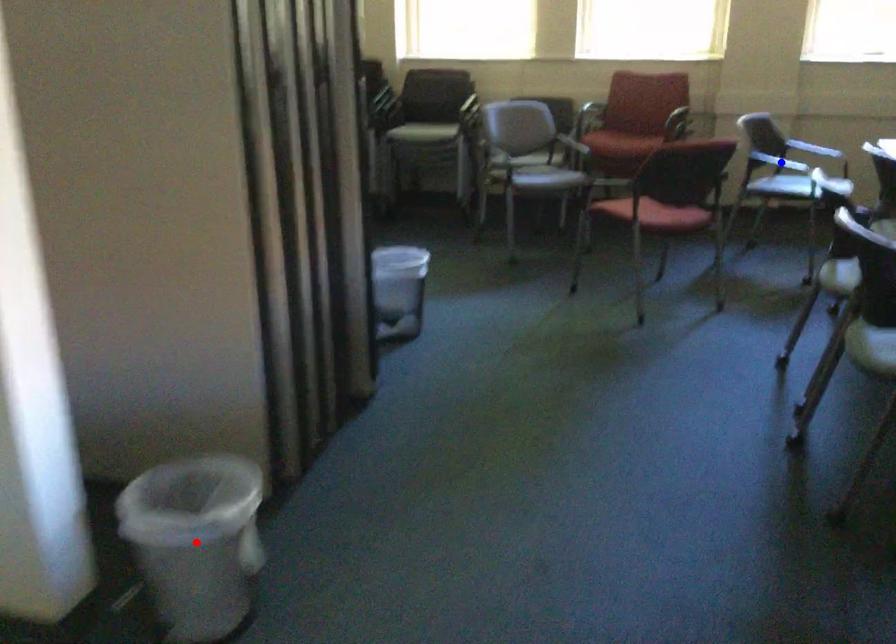
Question: In the image, two points are highlighted. Which point is nearer to the camera? Reply with the corresponding letter.

Choices:
 (A) blue point
 (B) red point

Answer: (B)